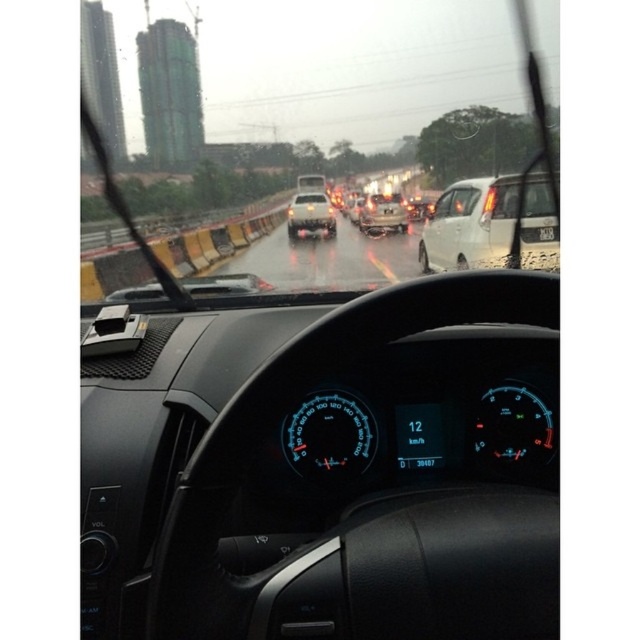
You are driving a car and notice the blue illuminated speedometer at center and the white matte car at center ahead. Which object is positioned to the right side from your perspective?

The white matte car at center is to the right of the blue illuminated speedometer at center.

You are driving a car and want to know if you have enough space to safely stop before hitting the white matte car at center. Your car can stop in 4 meters. Is there enough space?

The white matte car at center and viewer are 3.95 meters apart from each other. Since your car can stop in 4 meters, there is just enough space to safely stop before hitting the white matte car at center.

You are a passenger in the car and want to see the metallic silver suv at center through the transparent glass windshield at center. Is the windshield blocking your view of the SUV?

The transparent glass windshield at center is in front of the metallic silver suv at center, so the windshield is between you and the SUV. However, since the windshield is transparent, it won not block your view of the metallic silver suv at center.